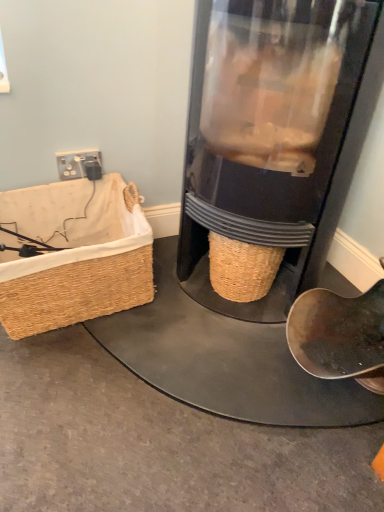
The width and height of the screenshot is (384, 512). I want to click on empty space that is in between transparent plastic coffee grinder at center and woven straw picnic basket at left, so click(138, 327).